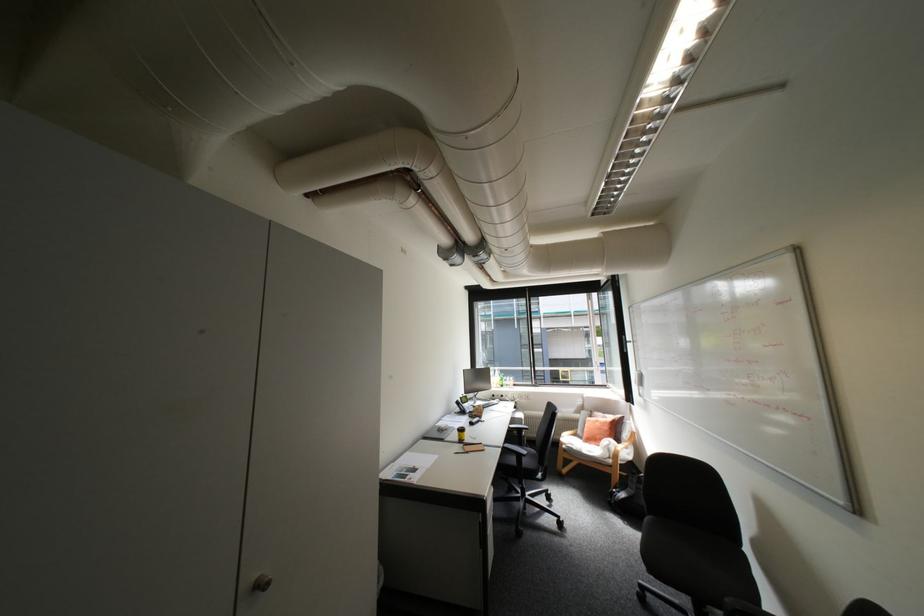
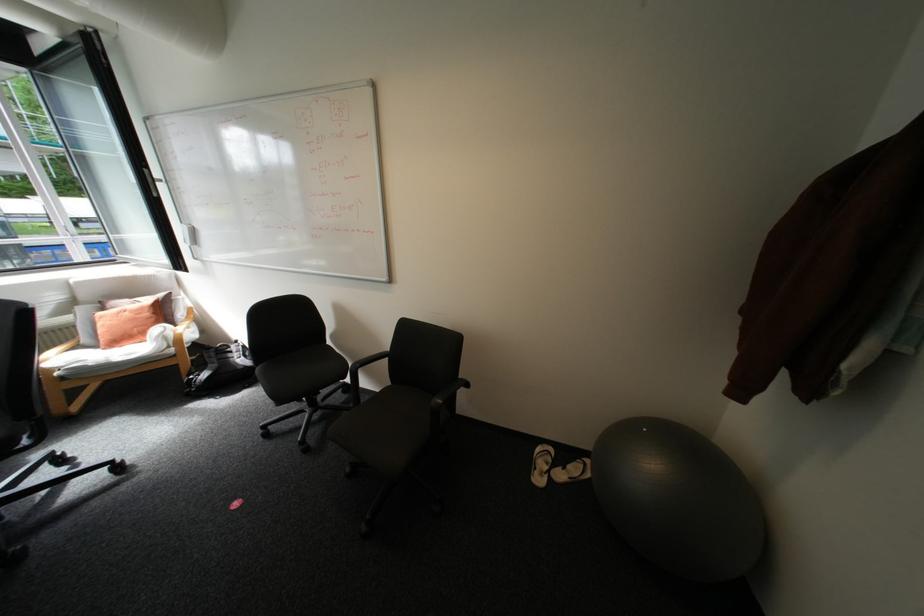
Based on the continuous images, in which direction is the camera rotating?

The rotation direction of the camera is right-down.